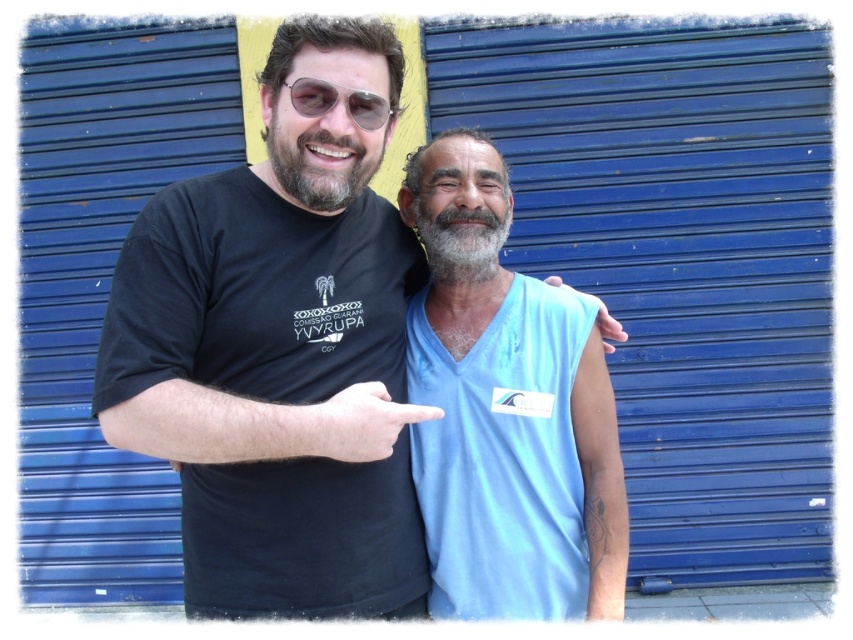
Question: Based on their relative distances, which object is farther from the black cotton t-shirt at center?

Choices:
 (A) light blue fabric at center
 (B) graywoollybeard at center

Answer: (B)

Question: Which point appears farthest from the camera in this image?

Choices:
 (A) (486, 269)
 (B) (606, 312)
 (C) (379, 125)

Answer: (B)

Question: Is graywoollybeard at center wider than matte black sunglasses at upper center?

Choices:
 (A) no
 (B) yes

Answer: (B)

Question: Which point is farther to the camera?

Choices:
 (A) beardsoft hair at upper center
 (B) skinny white hand at center

Answer: (A)

Question: Does light blue fabric at center lie behind beardsoft hair at upper center?

Choices:
 (A) no
 (B) yes

Answer: (B)

Question: Is light blue fabric at center further to camera compared to matte black sunglasses at upper center?

Choices:
 (A) yes
 (B) no

Answer: (A)